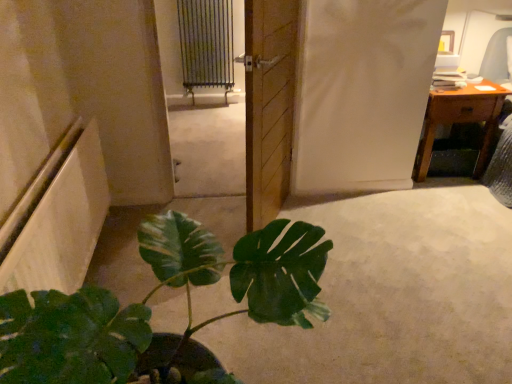
Question: In terms of width, does green matte plant at lower left look wider or thinner when compared to wooden desk at upper right?

Choices:
 (A) thin
 (B) wide

Answer: (B)

Question: In terms of height, does green matte plant at lower left look taller or shorter compared to wooden desk at upper right?

Choices:
 (A) short
 (B) tall

Answer: (B)

Question: Considering the real-world distances, which object is closest to the wooden door at center?

Choices:
 (A) metallic radiator at upper center
 (B) wooden desk at upper right
 (C) green matte plant at lower left

Answer: (C)

Question: Estimate the real-world distances between objects in this image. Which object is farther from the metallic radiator at upper center?

Choices:
 (A) wooden desk at upper right
 (B) green matte plant at lower left
 (C) wooden door at center

Answer: (B)